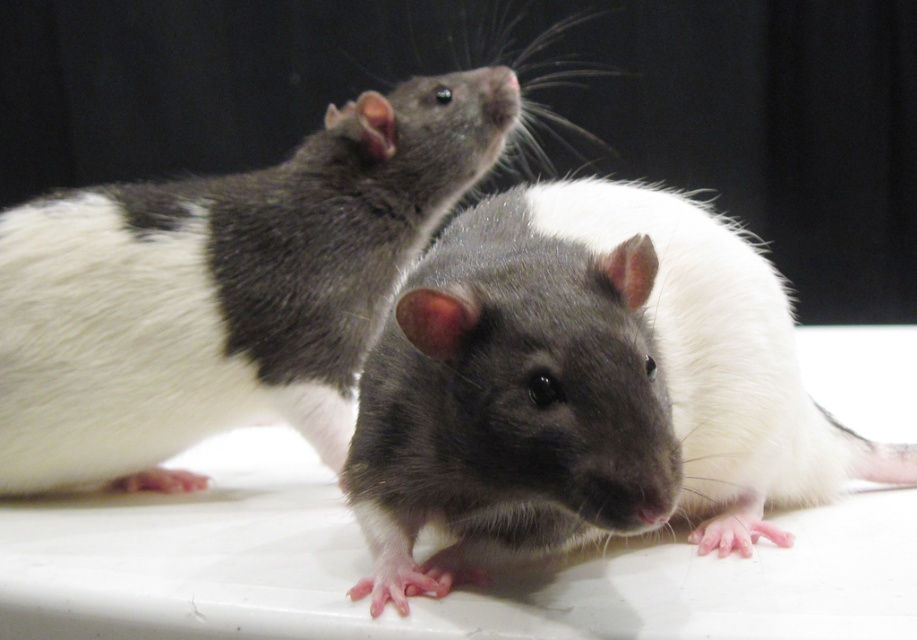
You are a photographer taking a picture of two rats on a white surface. You notice two specific points marked as point 1 and point 2. Point 1 is at coordinates point (263,301) and point 2 is at point (760,275). Which point is closer to the camera?

Point (263,301) is further to the camera than point (760,275), so point (760,275) is closer to the camera.

You are observing two rats in an image. The scene shows a shiny fur mouse at center and a shiny gray fur at center. Which of these two rats is positioned to the left?

The shiny fur mouse at center is positioned to the left of the shiny gray fur at center.

You are a scientist observing two rats in a lab. You notice the shiny fur mouse at center and the shiny gray fur at center. Which one has a greater height?

The shiny fur mouse at center is taller than the shiny gray fur at center.